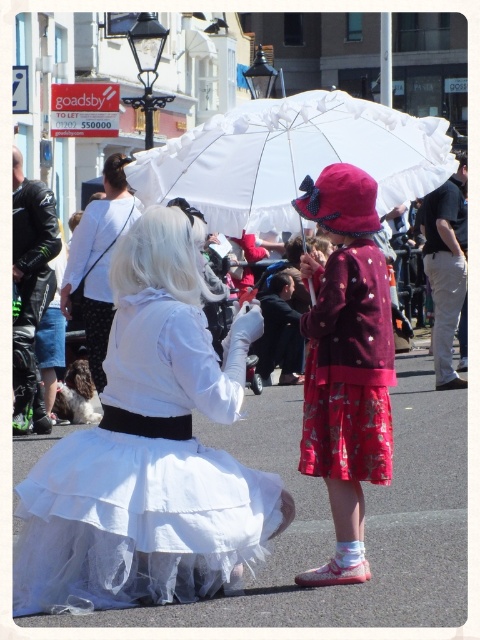
Question: In this image, where is white tulle skirt at center located relative to leather jacket at left?

Choices:
 (A) right
 (B) left

Answer: (A)

Question: From the image, what is the correct spatial relationship of white tulle skirt at center in relation to black cotton shirt at right?

Choices:
 (A) left
 (B) right

Answer: (A)

Question: Is white lace umbrella at upper center bigger than leather jacket at left?

Choices:
 (A) yes
 (B) no

Answer: (A)

Question: Which point is closer to the camera taking this photo?

Choices:
 (A) click(307, 403)
 (B) click(459, 298)
 (C) click(121, 275)
 (D) click(101, 307)

Answer: (A)

Question: Which object is the closest to the white tulle skirt at center?

Choices:
 (A) white lace umbrella at upper center
 (B) matte burgundy coat at center
 (C) leather jacket at left

Answer: (B)

Question: Estimate the real-world distances between objects in this image. Which object is farther from the white tulle skirt at center?

Choices:
 (A) white lace umbrella at upper center
 (B) black cotton shirt at right
 (C) leather jacket at left
 (D) matte burgundy coat at center

Answer: (B)